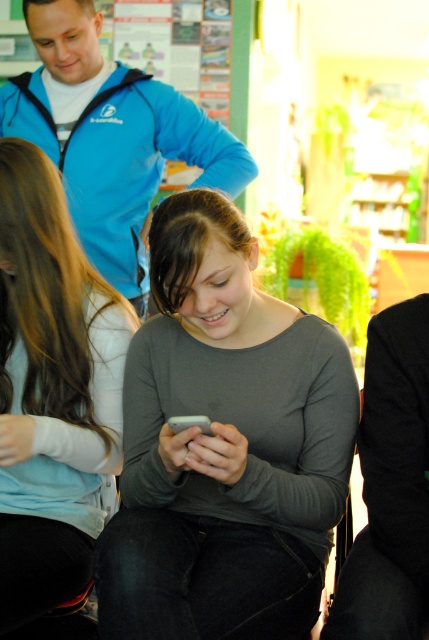
Does gray matte shirt at center have a greater height compared to blue fleece jacket at upper left?

Yes.

Who is positioned more to the left, gray matte shirt at center or blue fleece jacket at upper left?

Positioned to the left is blue fleece jacket at upper left.

Locate an element on the screen. Image resolution: width=429 pixels, height=640 pixels. gray matte shirt at center is located at coordinates (224, 445).

The image size is (429, 640). I want to click on gray matte shirt at center, so click(x=224, y=445).

Measure the distance from gray matte shirt at center to light brown hair at left.

A distance of 10.64 inches exists between gray matte shirt at center and light brown hair at left.

Who is more forward, (172, 250) or (27, 568)?

Point (172, 250) is more forward.

Which is behind, point (296, 518) or point (39, 285)?

The point (39, 285) is behind.

Locate an element on the screen. The height and width of the screenshot is (640, 429). gray matte shirt at center is located at coordinates (224, 445).

Between light brown hair at left and blue fleece jacket at upper left, which one is positioned higher?

blue fleece jacket at upper left

Measure the distance between light brown hair at left and camera.

light brown hair at left is 1.18 meters away from camera.

The height and width of the screenshot is (640, 429). Find the location of `light brown hair at left`. light brown hair at left is located at coordinates (53, 392).